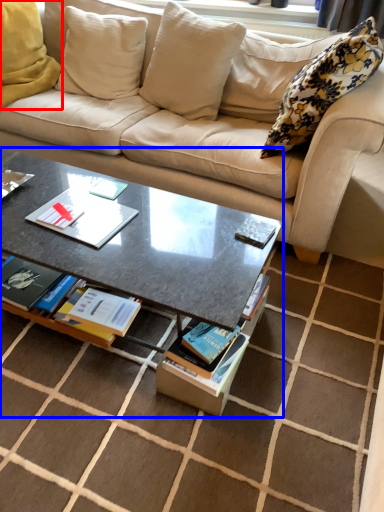
Question: Which object appears farthest to the camera in this image, pillow (highlighted by a red box) or coffee table (highlighted by a blue box)?

Choices:
 (A) pillow
 (B) coffee table

Answer: (A)